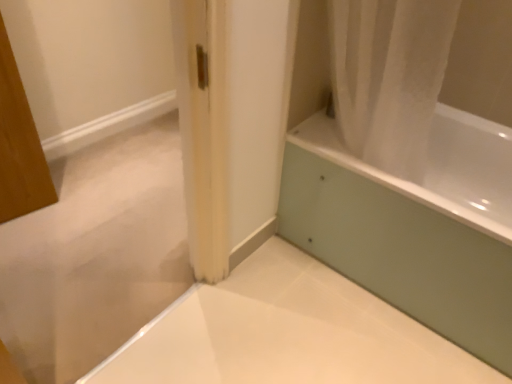
Describe the element at coordinates (439, 167) in the screenshot. I see `white glossy bathtub at upper right` at that location.

At what (x,y) coordinates should I click in order to perform the action: click on white glossy bathtub at upper right. Please return your answer as a coordinate pair (x, y). Looking at the image, I should click on (439, 167).

Find the location of a particular element. The height and width of the screenshot is (384, 512). white glossy bathtub at lower right is located at coordinates (414, 226).

What do you see at coordinates (414, 226) in the screenshot? I see `white glossy bathtub at lower right` at bounding box center [414, 226].

Identify the location of white glossy bathtub at upper right. Image resolution: width=512 pixels, height=384 pixels. (439, 167).

Considering the relative positions of white glossy bathtub at upper right and white glossy bathtub at lower right in the image provided, is white glossy bathtub at upper right to the left of white glossy bathtub at lower right from the viewer's perspective?

Yes, white glossy bathtub at upper right is to the left of white glossy bathtub at lower right.

Is white glossy bathtub at upper right positioned behind white glossy bathtub at lower right?

No, white glossy bathtub at upper right is closer to the camera.

Is point (478, 207) positioned after point (369, 247)?

Yes, point (478, 207) is behind point (369, 247).

From the image's perspective, which is below, white glossy bathtub at upper right or white glossy bathtub at lower right?

From the image's view, white glossy bathtub at lower right is below.

From a real-world perspective, is white glossy bathtub at upper right positioned above or below white glossy bathtub at lower right?

white glossy bathtub at upper right is above white glossy bathtub at lower right.

Is white glossy bathtub at upper right wider than white glossy bathtub at lower right?

In fact, white glossy bathtub at upper right might be narrower than white glossy bathtub at lower right.

Which of these two, white glossy bathtub at upper right or white glossy bathtub at lower right, stands shorter?

Standing shorter between the two is white glossy bathtub at lower right.

Can you confirm if white glossy bathtub at upper right is bigger than white glossy bathtub at lower right?

No, white glossy bathtub at upper right is not bigger than white glossy bathtub at lower right.

Is white glossy bathtub at upper right located outside white glossy bathtub at lower right?

Yes, white glossy bathtub at upper right is not within white glossy bathtub at lower right.

Is white glossy bathtub at upper right positioned far away from white glossy bathtub at lower right?

No.

Is white glossy bathtub at upper right oriented towards white glossy bathtub at lower right?

No, white glossy bathtub at upper right does not turn towards white glossy bathtub at lower right.

What's the angular difference between white glossy bathtub at upper right and white glossy bathtub at lower right's facing directions?

There is a 0.000555-degree angle between the facing directions of white glossy bathtub at upper right and white glossy bathtub at lower right.

Locate an element on the screen. bath located above the white glossy bathtub at lower right (from a real-world perspective) is located at coordinates (439, 167).

Is white glossy bathtub at lower right to the left or to the right of white glossy bathtub at upper right in the image?

Clearly, white glossy bathtub at lower right is on the right of white glossy bathtub at upper right in the image.

Is the depth of white glossy bathtub at lower right greater than that of white glossy bathtub at upper right?

Yes, white glossy bathtub at lower right is behind white glossy bathtub at upper right.

Considering the points (292, 189) and (439, 105), which point is in front, point (292, 189) or point (439, 105)?

Point (292, 189)

From the image's perspective, is white glossy bathtub at lower right above or below white glossy bathtub at upper right?

Clearly, from the image's perspective, white glossy bathtub at lower right is below white glossy bathtub at upper right.

From a real-world perspective, who is located higher, white glossy bathtub at lower right or white glossy bathtub at upper right?

From a 3D spatial view, white glossy bathtub at upper right is above.

Does white glossy bathtub at lower right have a lesser width compared to white glossy bathtub at upper right?

No, white glossy bathtub at lower right is not thinner than white glossy bathtub at upper right.

Who is taller, white glossy bathtub at lower right or white glossy bathtub at upper right?

white glossy bathtub at upper right is taller.

Considering the sizes of objects white glossy bathtub at lower right and white glossy bathtub at upper right in the image provided, who is bigger, white glossy bathtub at lower right or white glossy bathtub at upper right?

white glossy bathtub at lower right is bigger.

Can white glossy bathtub at upper right be found inside white glossy bathtub at lower right?

No, white glossy bathtub at upper right is located outside of white glossy bathtub at lower right.

Are white glossy bathtub at lower right and white glossy bathtub at upper right beside each other?

No.

From the picture: Is white glossy bathtub at lower right facing towards white glossy bathtub at upper right?

No, white glossy bathtub at lower right is not turned towards white glossy bathtub at upper right.

At what (x,y) coordinates should I click in order to perform the action: click on bath positioned vertically above the white glossy bathtub at lower right (from a real-world perspective). Please return your answer as a coordinate pair (x, y). The image size is (512, 384). Looking at the image, I should click on (439, 167).

Image resolution: width=512 pixels, height=384 pixels. What are the coordinates of `bathtub below the white glossy bathtub at upper right (from the image's perspective)` in the screenshot? It's located at (414, 226).

Locate an element on the screen. bathtub below the white glossy bathtub at upper right (from a real-world perspective) is located at coordinates (414, 226).